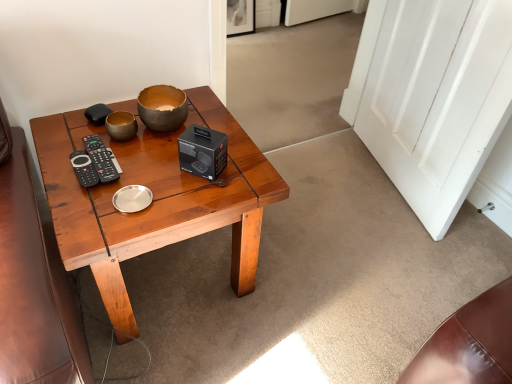
You are a GUI agent. You are given a task and a screenshot of the screen. Output one action in this format:
    pyautogui.click(x=<x>, y=<y>)
    Task: Click on the free space behind black plastic remote at left
    
    Given the screenshot: What is the action you would take?
    pyautogui.click(x=103, y=133)